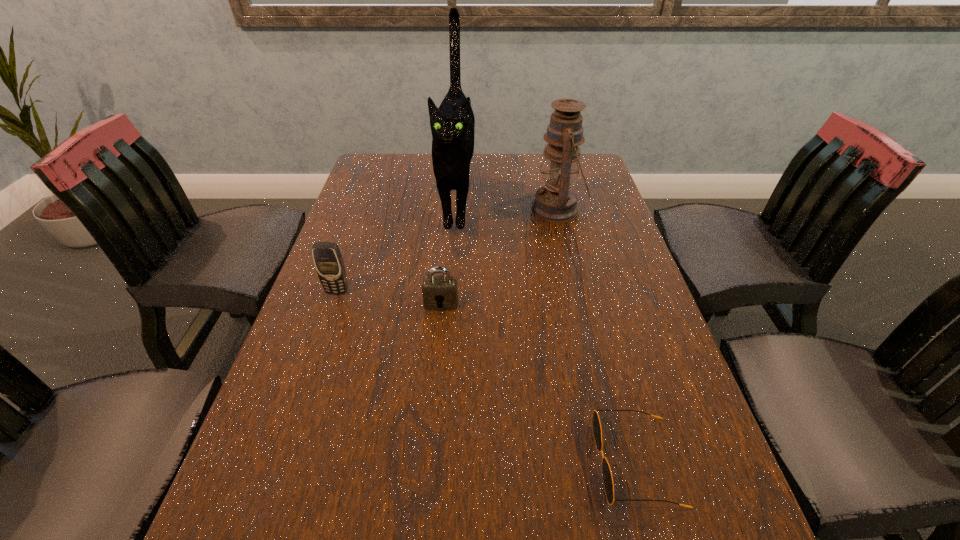
The height and width of the screenshot is (540, 960). I want to click on vacant space located on the front face of the cellular telephone, so click(330, 312).

Where is `vacant space located 0.190m at the front of the fourth tallest object near the keyhole`? vacant space located 0.190m at the front of the fourth tallest object near the keyhole is located at coordinates (434, 383).

What are the coordinates of `blank area located on the front-facing side of the shortest object` in the screenshot? It's located at (565, 462).

Where is `free space located 0.050m on the front-facing side of the shortest object`? The image size is (960, 540). free space located 0.050m on the front-facing side of the shortest object is located at coordinates (565, 462).

Locate an element on the screen. vacant space situated 0.250m on the front-facing side of the shortest object is located at coordinates (444, 462).

What are the coordinates of `object located in the far edge section of the desktop` in the screenshot? It's located at (452, 124).

Locate an element on the screen. object that is at the left edge is located at coordinates (328, 261).

Find the location of a particular element. This screenshot has width=960, height=540. oil lamp located at the right edge is located at coordinates (556, 202).

What are the coordinates of `sunglasses located at the right edge` in the screenshot? It's located at (596, 425).

Locate an element on the screen. This screenshot has width=960, height=540. free space at the far edge is located at coordinates (516, 188).